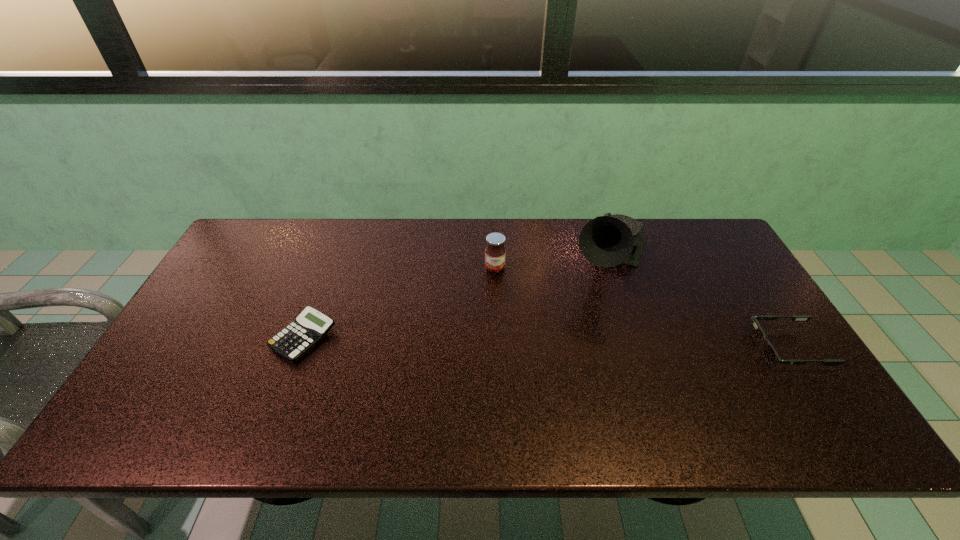
Find the location of a particular element. This screenshot has width=960, height=540. free spot on the desktop that is between the shortest object and the rightmost object and is positioned on the label side of the jam is located at coordinates (501, 342).

Where is `vacant space on the desktop that is between the calculator and the sunglasses and is positioned from the horn of the third object from left to right`? vacant space on the desktop that is between the calculator and the sunglasses and is positioned from the horn of the third object from left to right is located at coordinates (579, 343).